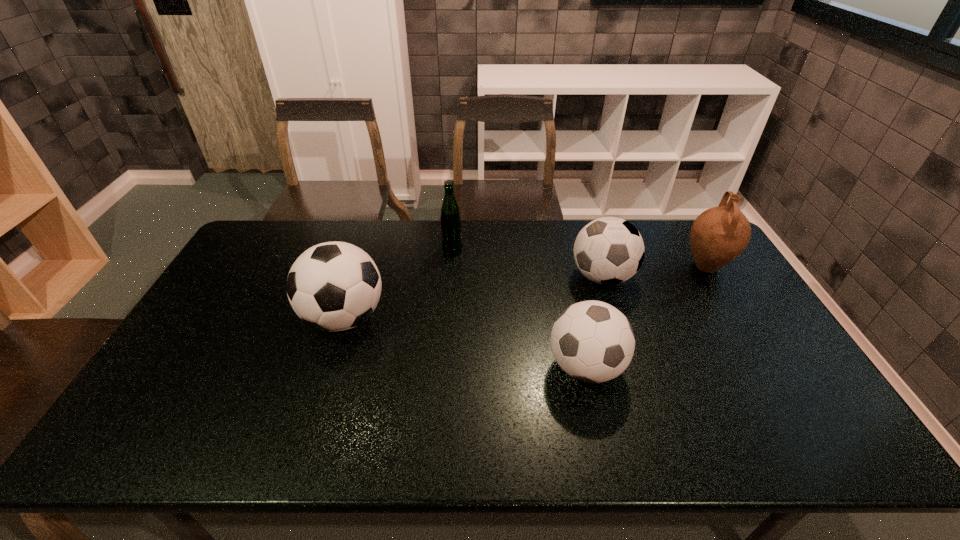
This screenshot has height=540, width=960. I want to click on pitcher, so click(x=719, y=235).

Where is `beer bottle`? The height and width of the screenshot is (540, 960). beer bottle is located at coordinates (450, 221).

In order to click on the leftmost soccer ball in this screenshot , I will do `click(334, 286)`.

What are the coordinates of `free space located 0.330m on the front of the rightmost object` in the screenshot? It's located at (766, 366).

Locate an element on the screen. This screenshot has height=540, width=960. free space located on the front of the beer bottle is located at coordinates (447, 307).

Identify the location of vacant region located on the front of the leftmost object. (321, 391).

Where is `pitcher at the far edge`? Image resolution: width=960 pixels, height=540 pixels. pitcher at the far edge is located at coordinates (719, 235).

Image resolution: width=960 pixels, height=540 pixels. Find the location of `beer bottle positioned at the far edge`. beer bottle positioned at the far edge is located at coordinates (450, 221).

Identify the location of soccer ball that is positioned at the far edge. (609, 250).

You are a GUI agent. You are given a task and a screenshot of the screen. Output one action in this format:
    pyautogui.click(x=<x>, y=<y>)
    Task: Click on the object that is at the right edge
    
    Given the screenshot: What is the action you would take?
    pyautogui.click(x=719, y=235)